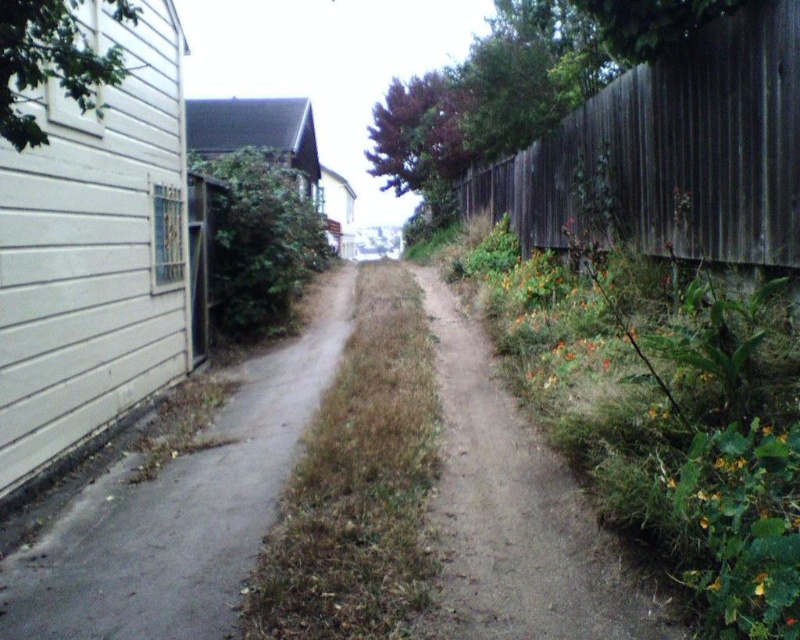
Is gray concrete path at left positioned in front of dry grass at center?

No, it is not.

Does point (140, 618) lie behind point (352, 400)?

No, it is in front of (352, 400).

Describe the element at coordinates (182, 509) in the screenshot. The height and width of the screenshot is (640, 800). I see `gray concrete path at left` at that location.

This screenshot has width=800, height=640. In order to click on gray concrete path at left in this screenshot , I will do `click(182, 509)`.

In the scene shown: Does gray concrete path at left have a greater width compared to brown dirt path at center?

Correct, the width of gray concrete path at left exceeds that of brown dirt path at center.

Does gray concrete path at left have a lesser width compared to brown dirt path at center?

In fact, gray concrete path at left might be wider than brown dirt path at center.

Image resolution: width=800 pixels, height=640 pixels. What do you see at coordinates (182, 509) in the screenshot?
I see `gray concrete path at left` at bounding box center [182, 509].

Image resolution: width=800 pixels, height=640 pixels. Identify the location of gray concrete path at left. (182, 509).

Which is more to the left, dark brown wood fence at right or brown dirt path at center?

Positioned to the left is brown dirt path at center.

Between point (726, 77) and point (480, 349), which one is positioned in front?

Point (726, 77) is in front.

In order to click on dark brown wood fence at right in this screenshot , I will do `click(674, 150)`.